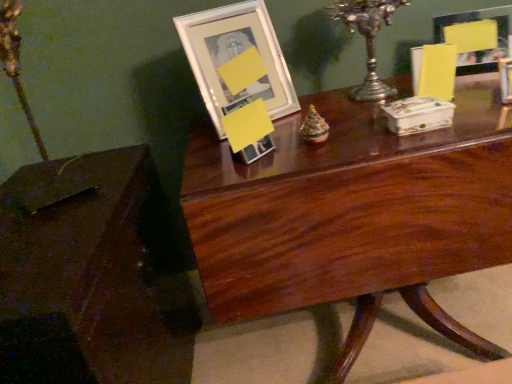
Question: From the image's perspective, is silver metallic candle holder at upper center located beneath mahogany wood table at center, which is the second table in left-to-right order?

Choices:
 (A) yes
 (B) no

Answer: (B)

Question: Can you confirm if silver metallic candle holder at upper center is positioned to the left of mahogany wood table at center, which is the second table in left-to-right order?

Choices:
 (A) yes
 (B) no

Answer: (A)

Question: From a real-world perspective, is silver metallic candle holder at upper center beneath mahogany wood table at center, which is the second table in left-to-right order?

Choices:
 (A) yes
 (B) no

Answer: (B)

Question: Is silver metallic candle holder at upper center next to mahogany wood table at center, acting as the first table starting from the right?

Choices:
 (A) yes
 (B) no

Answer: (B)

Question: Considering the relative sizes of silver metallic candle holder at upper center and mahogany wood table at center, acting as the first table starting from the right, in the image provided, is silver metallic candle holder at upper center shorter than mahogany wood table at center, acting as the first table starting from the right,?

Choices:
 (A) no
 (B) yes

Answer: (B)

Question: Could you tell me if silver metallic candle holder at upper center is turned towards mahogany wood table at center, acting as the first table starting from the right?

Choices:
 (A) yes
 (B) no

Answer: (B)

Question: Is mahogany wood table at center, acting as the first table starting from the right, looking in the opposite direction of matte glass picture frame at upper right, acting as the 1th picture frame starting from the right?

Choices:
 (A) yes
 (B) no

Answer: (B)

Question: Is mahogany wood table at center, acting as the first table starting from the right, outside of matte glass picture frame at upper right, which is counted as the 2th picture frame, starting from the left?

Choices:
 (A) no
 (B) yes

Answer: (B)

Question: Are mahogany wood table at center, which is the second table in left-to-right order, and matte glass picture frame at upper right, which is counted as the 2th picture frame, starting from the left, far apart?

Choices:
 (A) yes
 (B) no

Answer: (B)

Question: Can you confirm if mahogany wood table at center, which is the second table in left-to-right order, is thinner than matte glass picture frame at upper right, acting as the 1th picture frame starting from the right?

Choices:
 (A) no
 (B) yes

Answer: (A)

Question: From the image's perspective, is mahogany wood table at center, which is the second table in left-to-right order, over matte glass picture frame at upper right, acting as the 1th picture frame starting from the right?

Choices:
 (A) no
 (B) yes

Answer: (A)

Question: Is mahogany wood table at center, which is the second table in left-to-right order, wider than matte glass picture frame at upper right, which is counted as the 2th picture frame, starting from the left?

Choices:
 (A) no
 (B) yes

Answer: (B)

Question: Does brown polished wood table at lower left, the 1th table viewed from the left, turn towards silver metallic candle holder at upper center?

Choices:
 (A) no
 (B) yes

Answer: (B)